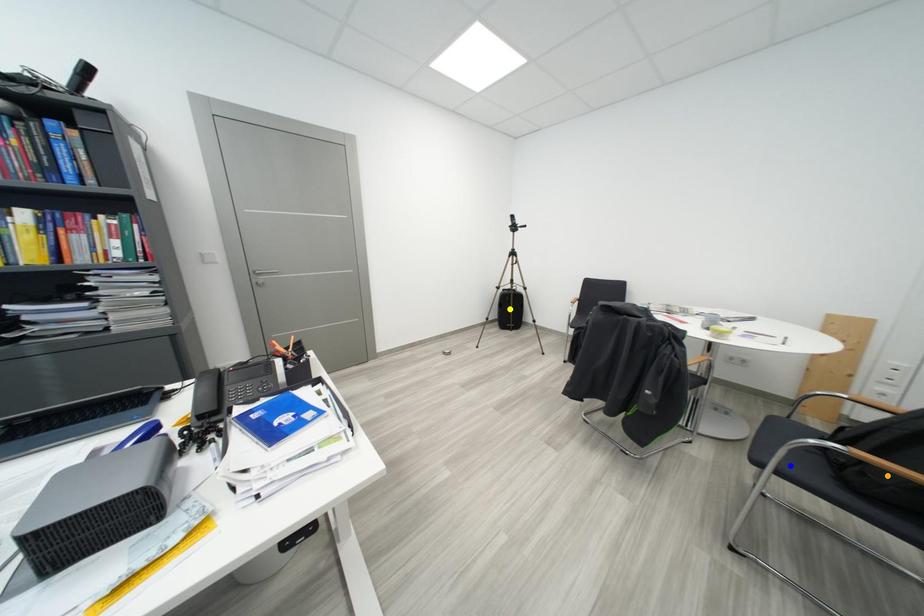
Order these from farthest to nearest:
- orange point
- yellow point
- blue point

yellow point < blue point < orange point